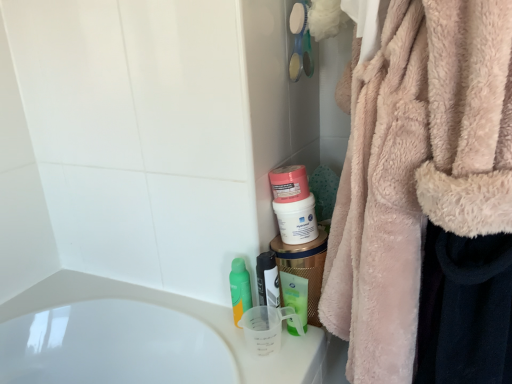
Question: Is pink matte jar at center, placed as the third mouthwash when sorted from left to right, at the left side of translucent plastic mouthwash at center, which is the 2th mouthwash from left to right?

Choices:
 (A) yes
 (B) no

Answer: (B)

Question: From the image's perspective, does pink matte jar at center, placed as the third mouthwash when sorted from left to right, appear lower than translucent plastic mouthwash at center, which is the 3th mouthwash in right-to-left order?

Choices:
 (A) yes
 (B) no

Answer: (B)

Question: Does pink matte jar at center, the 2th mouthwash viewed from the right, have a larger size compared to translucent plastic mouthwash at center, which is the 2th mouthwash from left to right?

Choices:
 (A) yes
 (B) no

Answer: (A)

Question: Considering the relative sizes of pink matte jar at center, placed as the third mouthwash when sorted from left to right, and translucent plastic mouthwash at center, which is the 3th mouthwash in right-to-left order, in the image provided, is pink matte jar at center, placed as the third mouthwash when sorted from left to right, taller than translucent plastic mouthwash at center, which is the 3th mouthwash in right-to-left order,?

Choices:
 (A) no
 (B) yes

Answer: (A)

Question: Is pink matte jar at center, the 2th mouthwash viewed from the right, surrounding translucent plastic mouthwash at center, which is the 3th mouthwash in right-to-left order?

Choices:
 (A) no
 (B) yes

Answer: (A)

Question: Is green matte bottle at center, the 1th mouthwash when ordered from left to right, bigger or smaller than pink matte jar at center, the 2th mouthwash viewed from the right?

Choices:
 (A) small
 (B) big

Answer: (A)

Question: Is point (245, 276) positioned closer to the camera than point (275, 205)?

Choices:
 (A) farther
 (B) closer

Answer: (B)

Question: Would you say green matte bottle at center, the 1th mouthwash when ordered from left to right, is to the left or to the right of pink matte jar at center, placed as the third mouthwash when sorted from left to right, in the picture?

Choices:
 (A) left
 (B) right

Answer: (A)

Question: Considering the positions of green matte bottle at center, the 1th mouthwash when ordered from left to right, and pink matte jar at center, the 2th mouthwash viewed from the right, in the image, is green matte bottle at center, the 1th mouthwash when ordered from left to right, wider or thinner than pink matte jar at center, the 2th mouthwash viewed from the right,?

Choices:
 (A) wide
 (B) thin

Answer: (B)

Question: In the image, is green matte bottle at center, the 1th mouthwash when ordered from left to right, on the left side or the right side of translucent plastic mouthwash at center, which is the 2th mouthwash from left to right?

Choices:
 (A) left
 (B) right

Answer: (A)

Question: Looking at their shapes, would you say green matte bottle at center, the 1th mouthwash when ordered from left to right, is wider or thinner than translucent plastic mouthwash at center, which is the 3th mouthwash in right-to-left order?

Choices:
 (A) thin
 (B) wide

Answer: (A)

Question: Considering the positions of green matte bottle at center, the 1th mouthwash when ordered from left to right, and translucent plastic mouthwash at center, which is the 2th mouthwash from left to right, in the image, is green matte bottle at center, the 1th mouthwash when ordered from left to right, bigger or smaller than translucent plastic mouthwash at center, which is the 2th mouthwash from left to right,?

Choices:
 (A) big
 (B) small

Answer: (B)

Question: Choose the correct answer: Is green matte bottle at center, the 4th mouthwash in the right-to-left sequence, inside translucent plastic mouthwash at center, which is the 2th mouthwash from left to right, or outside it?

Choices:
 (A) outside
 (B) inside

Answer: (A)

Question: In terms of width, does green matte bottle at center, the 4th mouthwash in the right-to-left sequence, look wider or thinner when compared to green plastic mouthwash at lower center, acting as the fourth mouthwash starting from the left?

Choices:
 (A) thin
 (B) wide

Answer: (A)

Question: Relative to green plastic mouthwash at lower center, acting as the fourth mouthwash starting from the left, is green matte bottle at center, the 1th mouthwash when ordered from left to right, in front or behind?

Choices:
 (A) behind
 (B) front

Answer: (A)